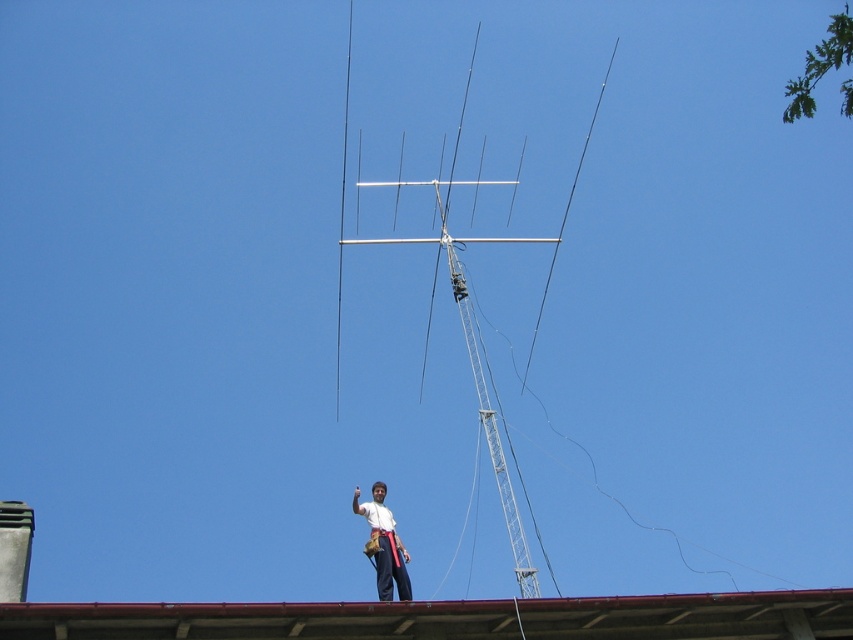
Which is in front, point (451, 604) or point (392, 584)?

Point (451, 604)

Is point (524, 627) positioned after point (399, 560)?

No, it is in front of (399, 560).

Describe the element at coordinates (450, 618) in the screenshot. Image resolution: width=853 pixels, height=640 pixels. I see `red metal roof at center` at that location.

Find the location of `red metal roof at center`. red metal roof at center is located at coordinates point(450,618).